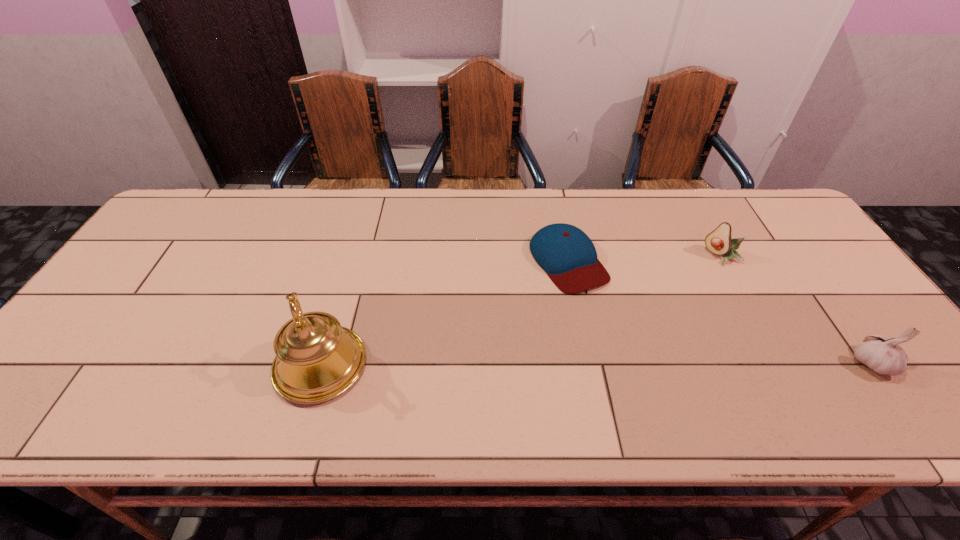
Identify the location of vacant spot on the desktop that is between the bell and the garlic and is positioned on the seed side of the avocado. The height and width of the screenshot is (540, 960). click(593, 364).

Find the location of a particular element. free space on the desktop that is between the leftmost object and the rightmost object and is positioned with the bill of the second object from left to right facing forward is located at coordinates (648, 363).